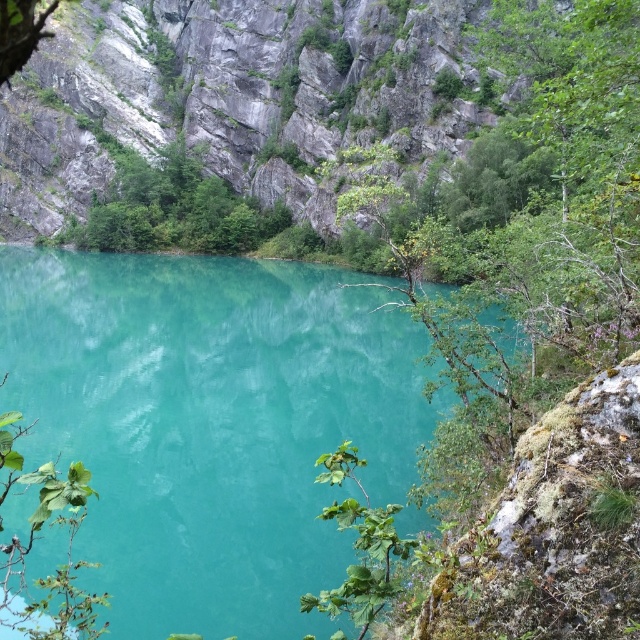
You are standing at the edge of the lake and see two points marked in the scene. The first point is at coordinates point (19, 621) and the second is at point (392, 580). Which point is closer to you?

Point (19, 621) is further to the camera than point (392, 580), so the second point is closer to you.

You are standing at the edge of the lake and want to place a small statue on the ground between the turquoise glossy water at center and the green leafy plant at lower right. Considering their positions, which object is closer to you where you can place the statue?

The green leafy plant at lower right is closer to you, so you can place the statue near it since it is nearer than the turquoise glossy water at center.

You are standing at the edge of the lake and see the green leafy tree at center and the green leafy plant at lower right. Which one is closer to your right side?

The green leafy plant at lower right is closer to your right side because the green leafy tree at center is positioned on the left side of it.